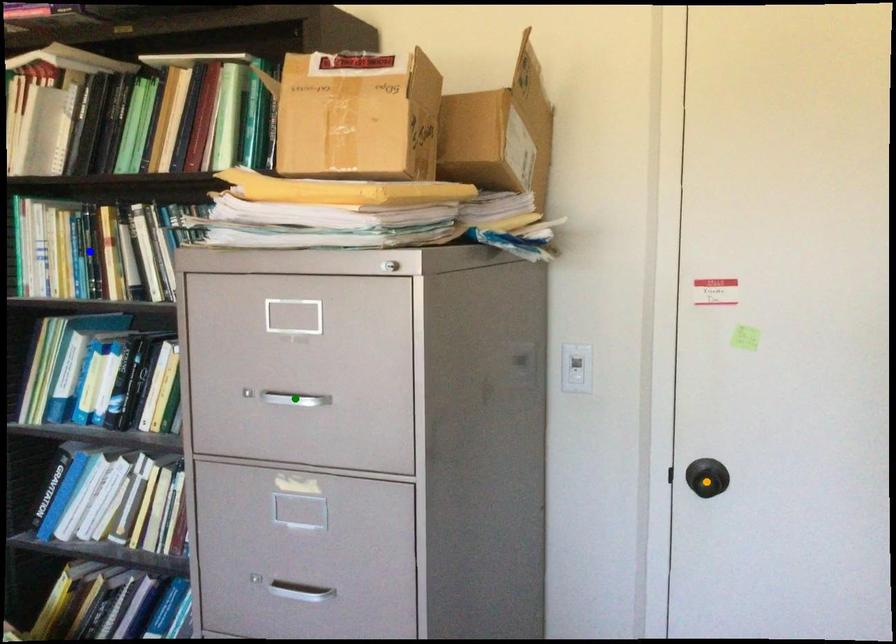
Order these from nearest to farthest:
blue point
green point
orange point

green point, orange point, blue point